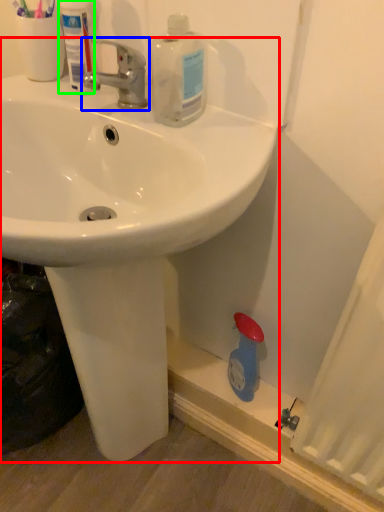
Question: Which object is positioned farthest from sink (highlighted by a red box)? Select from tap (highlighted by a blue box) and mouthwash (highlighted by a green box).

Choices:
 (A) tap
 (B) mouthwash

Answer: (B)